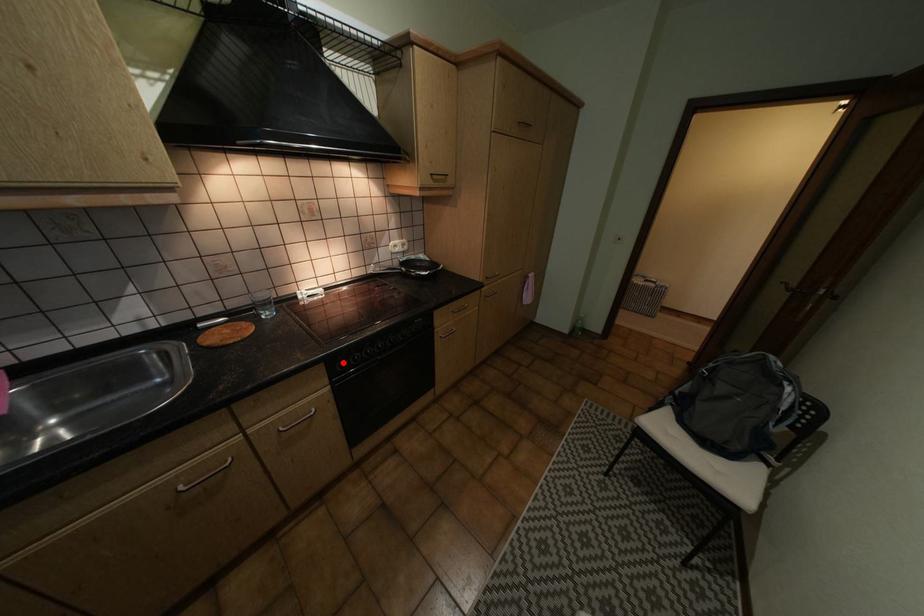
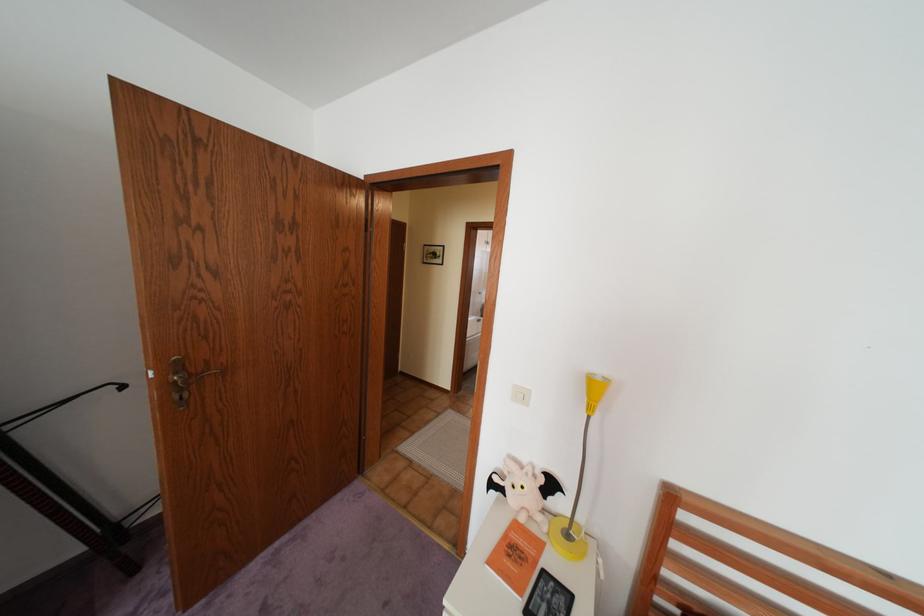
Question: I am providing you with two images of the same scene from different viewpoints. A red point is marked on the first image. At the location where the point appears in image 1, is it still visible in image 2?

Choices:
 (A) Yes
 (B) No

Answer: (B)